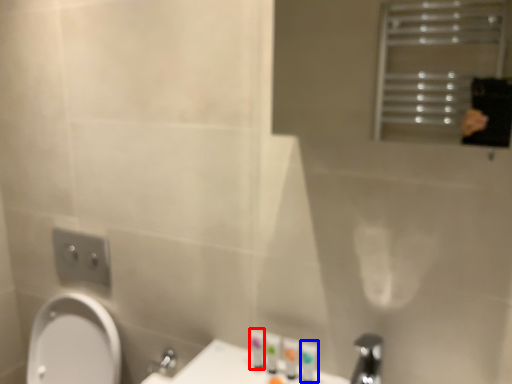
Question: Which of the following is the farthest to the observer, toiletry (highlighted by a red box) or toiletry (highlighted by a blue box)?

Choices:
 (A) toiletry
 (B) toiletry

Answer: (A)